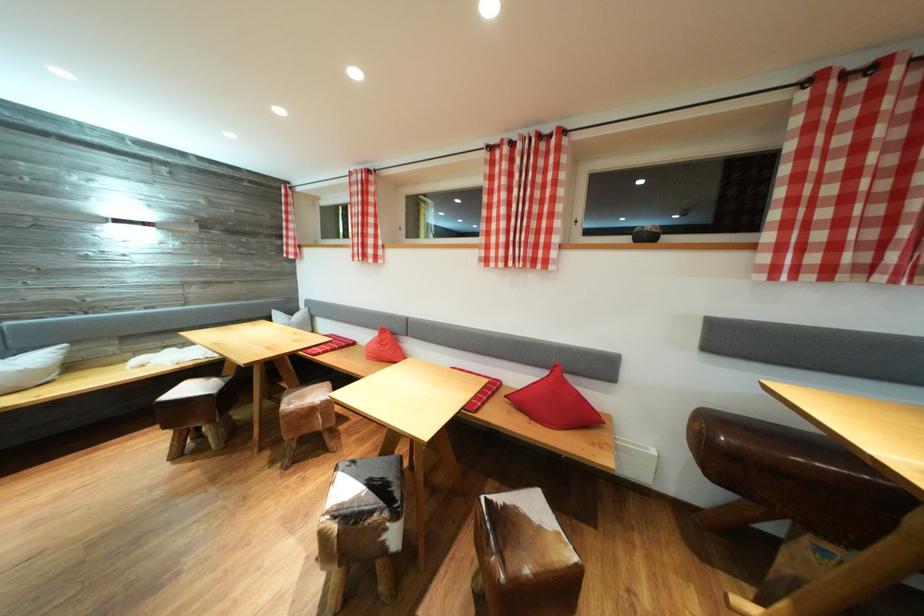
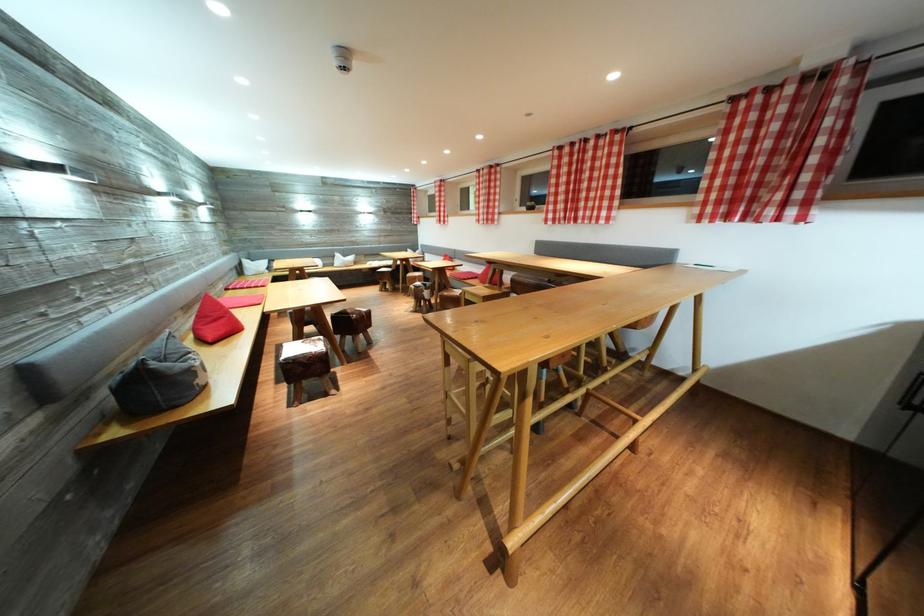
Locate, in the second image, the point that corresponds to [203,434] in the first image.

(393, 289)